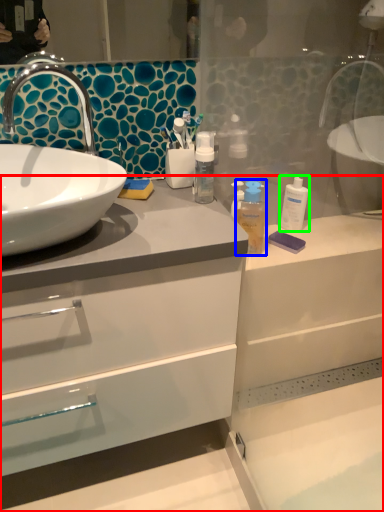
Question: Based on their relative distances, which object is farther from bathroom cabinet (highlighted by a red box)? Choose from mouthwash (highlighted by a blue box) and mouthwash (highlighted by a green box).

Choices:
 (A) mouthwash
 (B) mouthwash

Answer: (B)